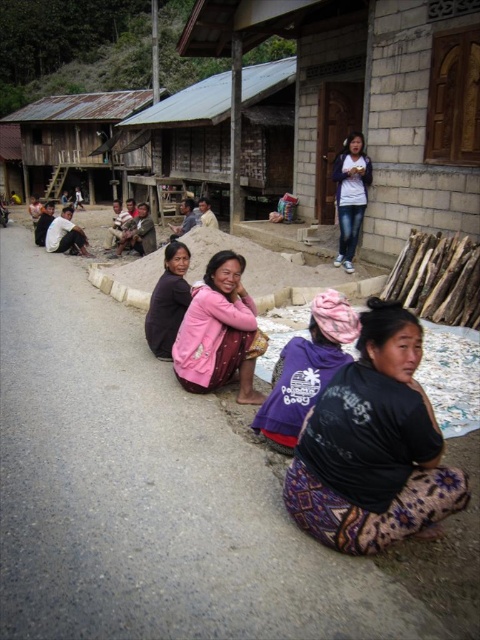
Who is positioned more to the right, black cotton shirt at lower center or pink fabric at center?

black cotton shirt at lower center is more to the right.

Does black cotton shirt at lower center have a larger size compared to pink fabric at center?

Correct, black cotton shirt at lower center is larger in size than pink fabric at center.

Find the location of a particular element. The width and height of the screenshot is (480, 640). black cotton shirt at lower center is located at coordinates (372, 445).

Does point (203, 179) come behind point (66, 211)?

Yes, it is behind point (66, 211).

Does rustic wooden hut at center have a lesser height compared to matte black shirt at left?

Incorrect, rustic wooden hut at center's height does not fall short of matte black shirt at left's.

Which is in front, point (249, 179) or point (52, 220)?

Positioned in front is point (52, 220).

At what (x,y) coordinates should I click in order to perform the action: click on rustic wooden hut at center. Please return your answer as a coordinate pair (x, y). Looking at the image, I should click on (186, 138).

Which is behind, point (212, 296) or point (261, 419)?

The point (212, 296) is more distant.

Between pink fabric at center and purple fabric at center, which one has more height?

With more height is pink fabric at center.

Which is in front, point (193, 369) or point (324, 362)?

Point (324, 362) is more forward.

Identify the location of pink fabric at center. This screenshot has width=480, height=640. (218, 332).